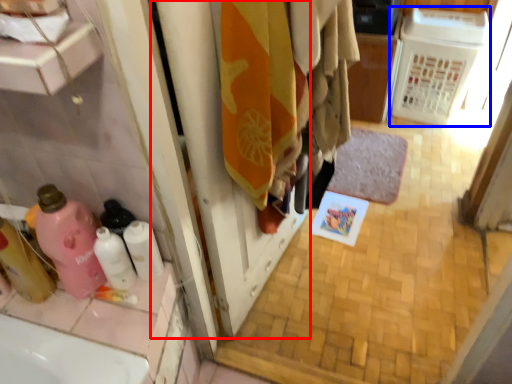
Question: Among these objects, which one is farthest to the camera, screen door (highlighted by a red box) or appliance (highlighted by a blue box)?

Choices:
 (A) screen door
 (B) appliance

Answer: (B)